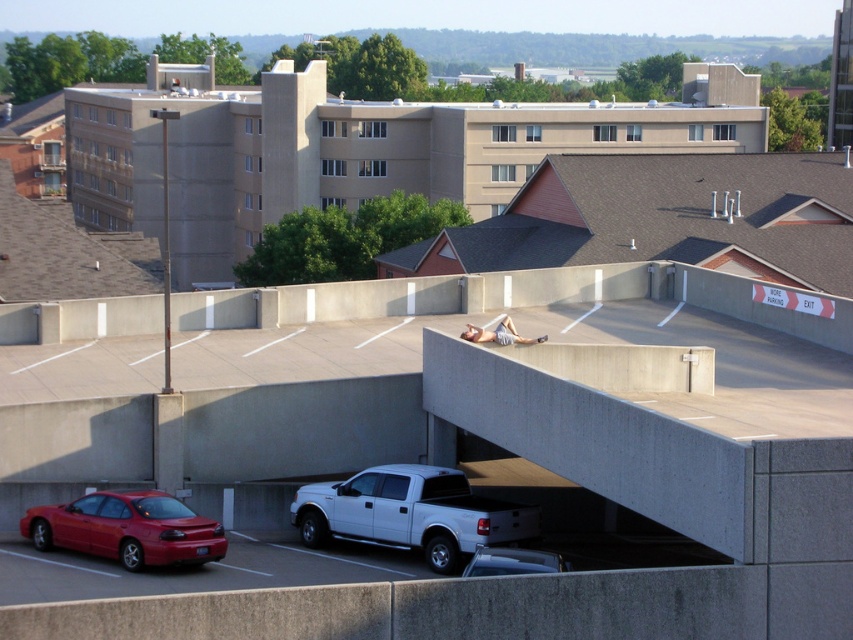
Is white matte pickup truck at center wider than metallic silver truck at lower center?

Yes, white matte pickup truck at center is wider than metallic silver truck at lower center.

Which is more to the right, white matte pickup truck at center or metallic silver truck at lower center?

metallic silver truck at lower center is more to the right.

Between point (405, 545) and point (521, 557), which one is positioned behind?

Point (405, 545)

You are a GUI agent. You are given a task and a screenshot of the screen. Output one action in this format:
    pyautogui.click(x=<x>, y=<y>)
    Task: Click on the white matte pickup truck at center
    The image size is (853, 640).
    Given the screenshot: What is the action you would take?
    pyautogui.click(x=410, y=513)

Is point (138, 228) closer to camera compared to point (488, 573)?

No, it is behind (488, 573).

Describe the element at coordinates (351, 150) in the screenshot. I see `concrete parking garage at upper center` at that location.

This screenshot has width=853, height=640. In order to click on concrete parking garage at upper center in this screenshot , I will do `click(351, 150)`.

Does concrete parking garage at upper center have a smaller size compared to white matte pickup truck at center?

Incorrect, concrete parking garage at upper center is not smaller in size than white matte pickup truck at center.

Based on the photo, does concrete parking garage at upper center have a lesser width compared to white matte pickup truck at center?

No.

Who is more forward, [422,188] or [427,564]?

Positioned in front is point [427,564].

The height and width of the screenshot is (640, 853). Identify the location of concrete parking garage at upper center. (351, 150).